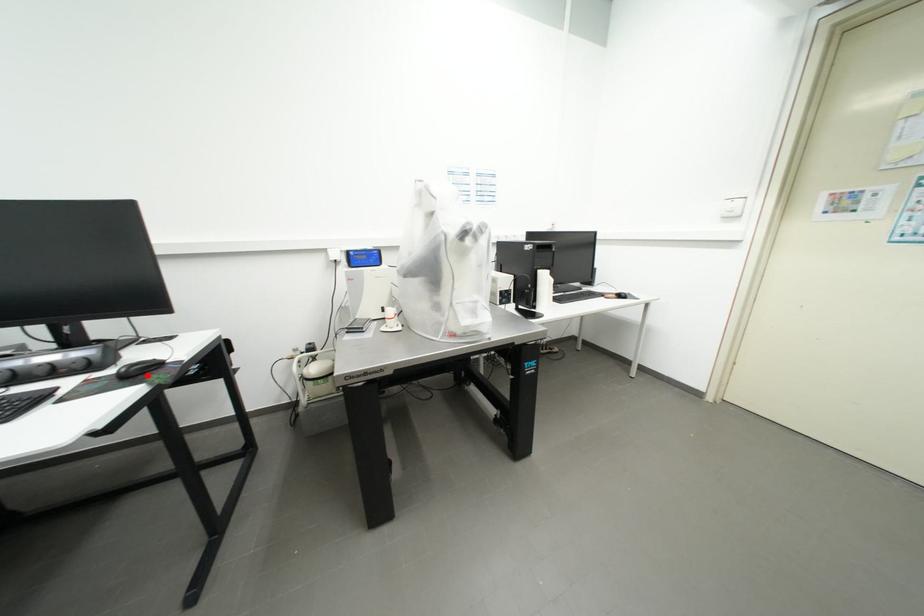
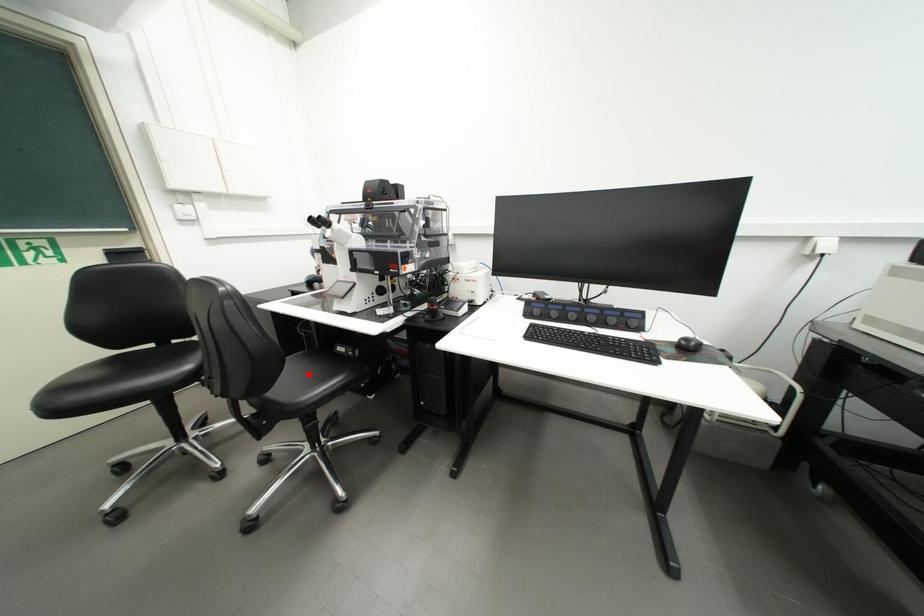
I am providing you with two images of the same scene from different viewpoints. A red point is marked on the first image and another point is marked on the second image. Are the points marked in image1 and image2 representing the same 3D position?

No